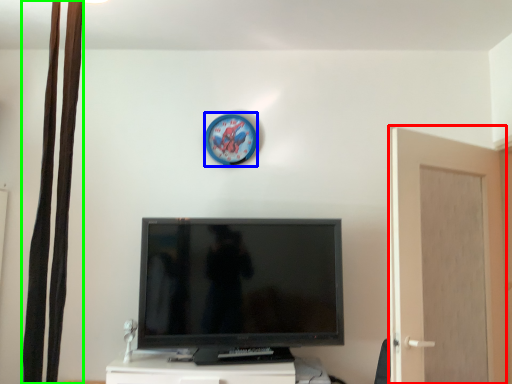
Question: Based on their relative distances, which object is farther from screen door (highlighted by a red box)? Choose from clock (highlighted by a blue box) and curtain (highlighted by a green box).

Choices:
 (A) clock
 (B) curtain

Answer: (B)